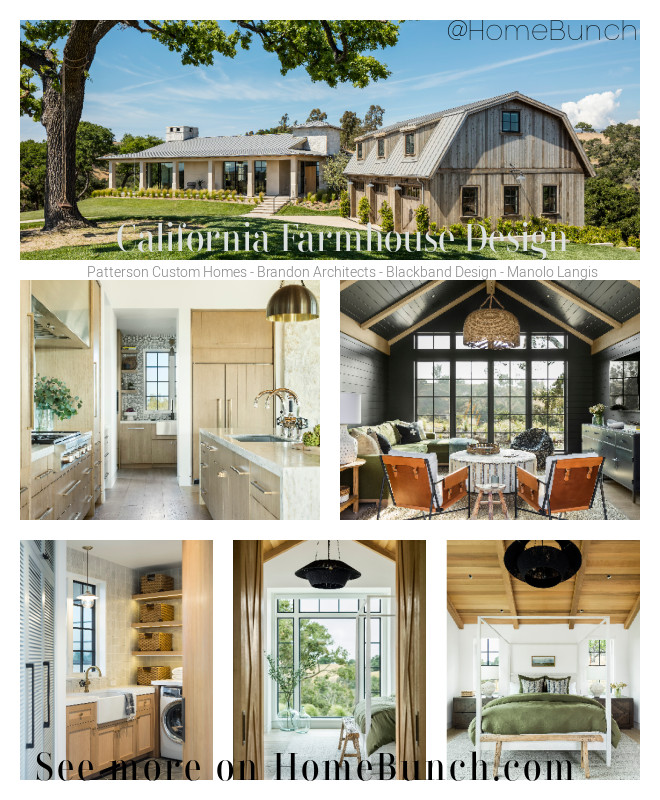
Identify the location of light lamp. This screenshot has width=660, height=800. (88, 594).